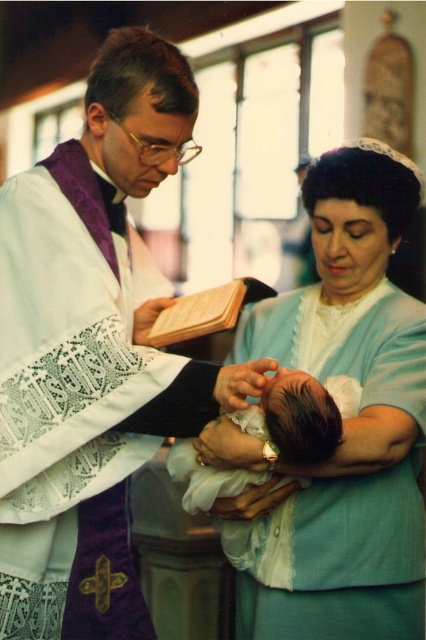
You are a photographer who wants to capture a closeup of the light blue fabric dress at center and dark brown hair at center in the scene. Since you can only focus on one object at a time, which object should you choose to ensure the entire width of the subject fits within your camera frame? Explain your reasoning based on their widths.

The light blue fabric dress at center has a greater width than the dark brown hair at center. Therefore, to ensure the entire width of the subject fits within the camera frame, you should focus on the light blue fabric dress at center first, as it requires a wider framing. If the frame can accommodate its width, it will also fit the narrower dark brown hair at center.

You are a photographer taking a picture of the baptism scene. You need to focus on the light blue fabric dress at center and dark brown hair at center. Which object should you adjust your camera to capture first if you want to start with the one on the left?

The dark brown hair at center is on the left side of the light blue fabric dress at center, so you should adjust your camera to capture the dark brown hair at center first.

You are a photographer taking a picture of the baptism scene. You notice the dark brown hair at center and the light blue fabric dress at center. Which object is closer to the camera?

The light blue fabric dress at center is closer to the camera because the dark brown hair at center is behind it.